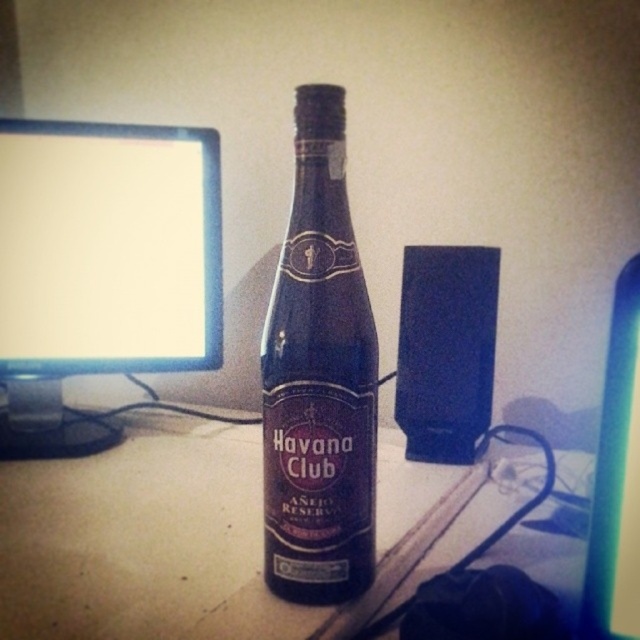
You are organizing your workspace and need to place a small plant between the matte plastic computer desk at center and the matte black monitor at left. Which object should the plant be closer to if you want it to be closer to the taller object?

The matte black monitor at left is taller than the matte plastic computer desk at center. Therefore, the plant should be placed closer to the matte black monitor at left to be near the taller object.

You are organizing items on your desk and need to place a small paperweight. The point at coordinates (145,541) marks the location of the matte plastic computer desk at center. Where should you place the paperweight to ensure it stays on the desk?

The point at coordinates (145,541) indicates the matte plastic computer desk at center, so placing the paperweight anywhere on the desk surface within the desk area will keep it stable.